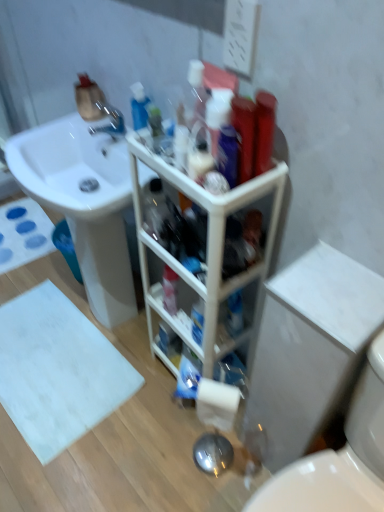
Locate an element on the screen. vacant space that is to the left of white plastic cabinet at center is located at coordinates (133, 402).